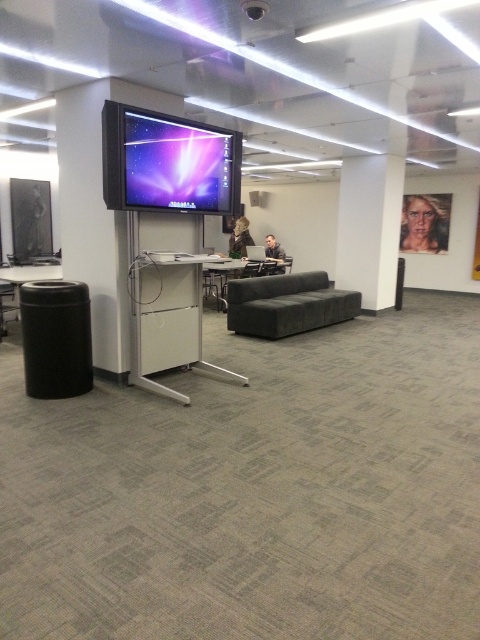
Question: Based on their relative distances, which object is farther from the matte gray couch at center?

Choices:
 (A) black plastic table at lower left
 (B) dark gray fabric couch at center

Answer: (A)

Question: Which object is closer to the camera taking this photo?

Choices:
 (A) matte gray couch at center
 (B) black plastic table at lower left

Answer: (B)

Question: Is dark gray fabric couch at center positioned behind black plastic table at lower left?

Choices:
 (A) yes
 (B) no

Answer: (A)

Question: Is dark gray fabric couch at center closer to camera compared to black plastic table at lower left?

Choices:
 (A) yes
 (B) no

Answer: (B)

Question: Which of the following is the closest to the observer?

Choices:
 (A) matte gray couch at center
 (B) black plastic table at lower left
 (C) dark gray fabric couch at center

Answer: (B)

Question: Can you confirm if matte gray couch at center is positioned to the left of black plastic table at lower left?

Choices:
 (A) no
 (B) yes

Answer: (A)